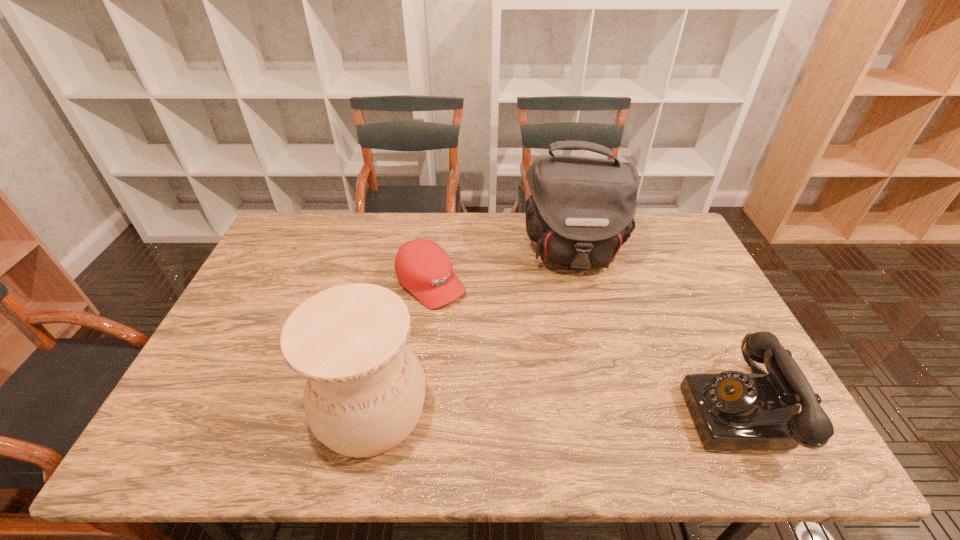
Identify the location of free spot on the desktop that is between the second tallest object and the rightmost object and is positioned on the front-facing side of the shortest object. This screenshot has width=960, height=540. (573, 410).

This screenshot has height=540, width=960. I want to click on vacant space on the desktop that is between the third shortest object and the rightmost object and is positioned on the open flap of the second object from right to left, so click(x=588, y=410).